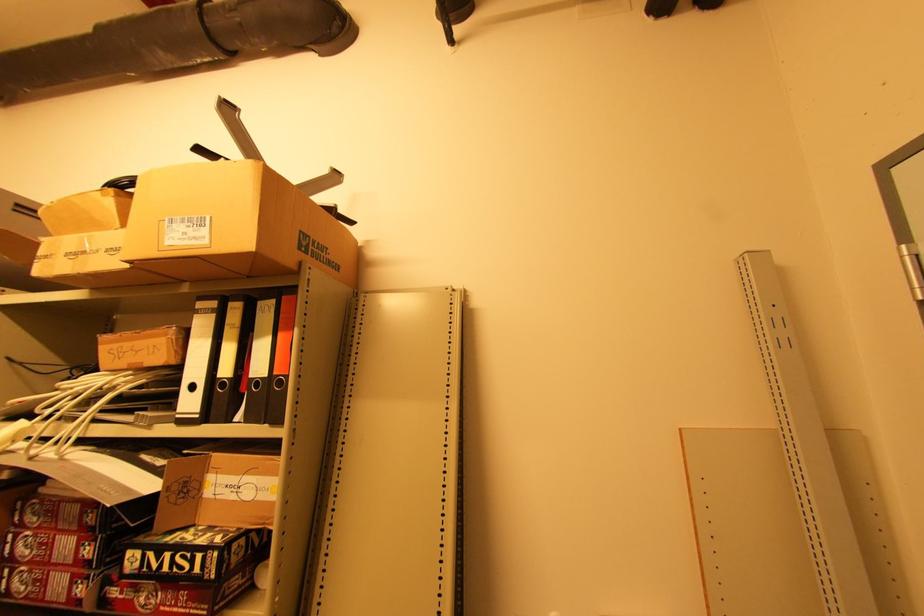
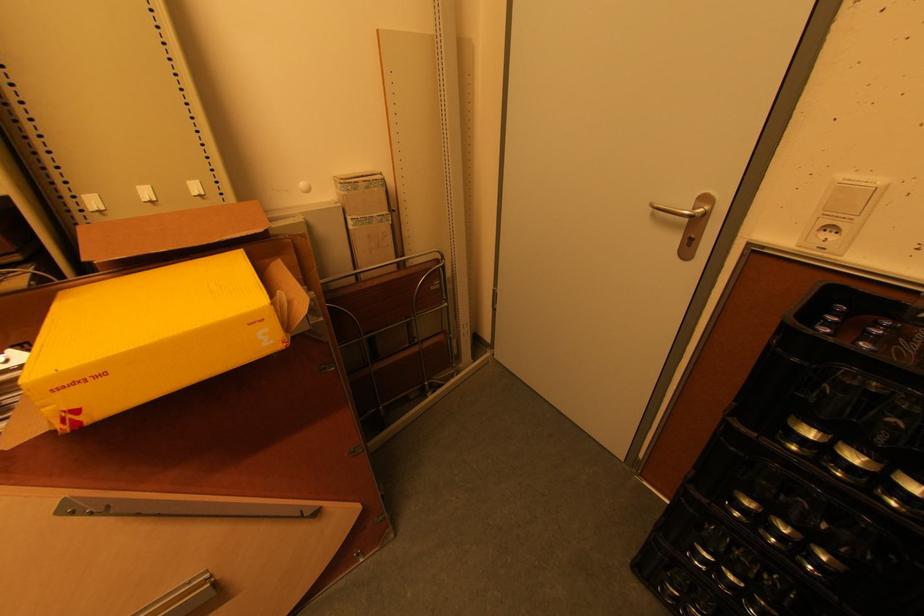
The images are taken continuously from a first-person perspective. In which direction is your viewpoint rotating?

The camera rotated toward right-down.